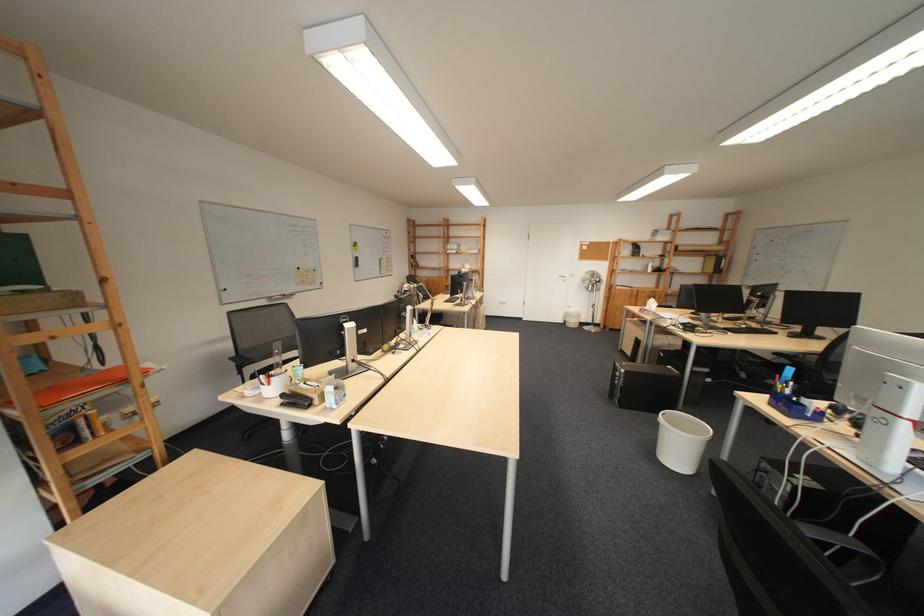
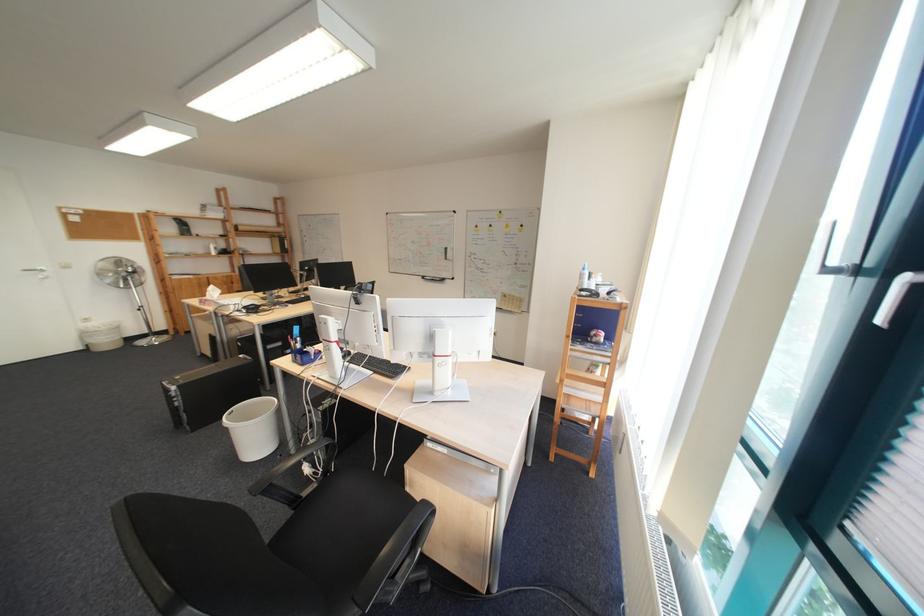
The point at (672, 427) is marked in the first image. Where is the corresponding point in the second image?

(239, 430)